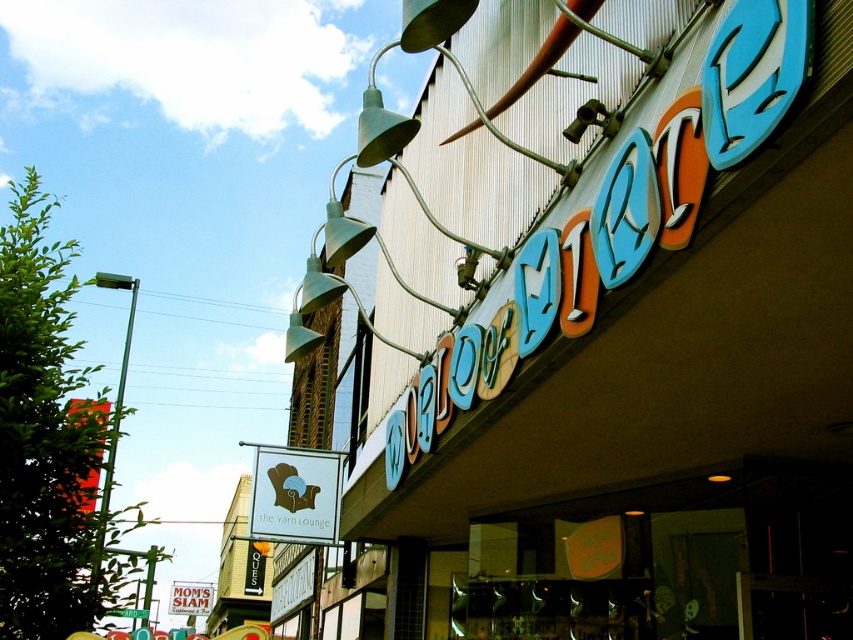
Question: Is metallic signboard at upper center below white plastic sign at upper center?

Choices:
 (A) no
 (B) yes

Answer: (A)

Question: Does matte white sign at center have a lesser width compared to white plastic sign at upper center?

Choices:
 (A) yes
 (B) no

Answer: (A)

Question: Estimate the real-world distances between objects in this image. Which object is closer to the matte white sign at center?

Choices:
 (A) white plastic sign at upper center
 (B) metallic signboard at upper center

Answer: (B)

Question: Among these objects, which one is nearest to the camera?

Choices:
 (A) white plastic sign at upper center
 (B) matte white sign at center
 (C) metallic signboard at upper center

Answer: (C)

Question: Estimate the real-world distances between objects in this image. Which object is closer to the matte white sign at center?

Choices:
 (A) metallic signboard at upper center
 (B) white plastic sign at upper center

Answer: (A)

Question: Is metallic signboard at upper center wider than matte white sign at center?

Choices:
 (A) no
 (B) yes

Answer: (B)